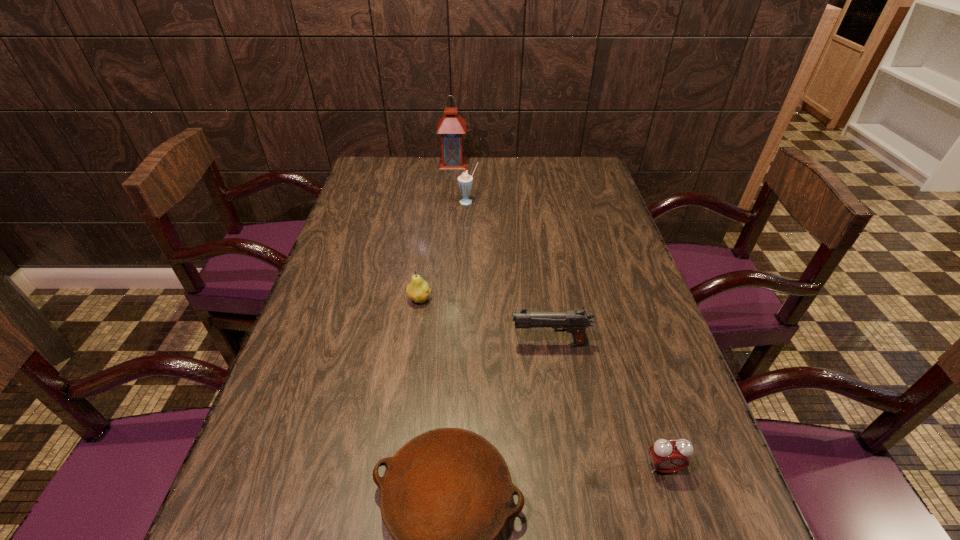
You are a GUI agent. You are given a task and a screenshot of the screen. Output one action in this format:
    pyautogui.click(x=<x>, y=<y>)
    Task: Click on the vacant space located 0.330m in the direction the third tallest object is aimed
    The image size is (960, 540).
    Given the screenshot: What is the action you would take?
    pyautogui.click(x=367, y=343)

Where is `free region located in the direction the third tallest object is aimed`? The image size is (960, 540). free region located in the direction the third tallest object is aimed is located at coordinates (449, 343).

The image size is (960, 540). Identify the location of vacant position located 0.090m in the direction the third tallest object is aimed. point(471,343).

Find the location of `free space located 0.360m on the back of the third farthest object`. free space located 0.360m on the back of the third farthest object is located at coordinates (432, 213).

This screenshot has width=960, height=540. Identify the location of free location located 0.060m on the clock face of the rightmost object. (677, 512).

Locate an element on the screen. This screenshot has height=540, width=960. object that is at the far edge is located at coordinates (451, 126).

You are a GUI agent. You are given a task and a screenshot of the screen. Output one action in this format:
    pyautogui.click(x=<x>, y=<y>)
    Task: Click on the object at the right edge
    
    Given the screenshot: What is the action you would take?
    pyautogui.click(x=668, y=456)

In the image, there is a desktop. Where is `vacant space at the far edge`? The image size is (960, 540). vacant space at the far edge is located at coordinates (434, 172).

Identify the location of free point at the left edge. Image resolution: width=960 pixels, height=540 pixels. (320, 373).

Where is `vacant area at the right edge of the desktop`? The image size is (960, 540). vacant area at the right edge of the desktop is located at coordinates (564, 209).